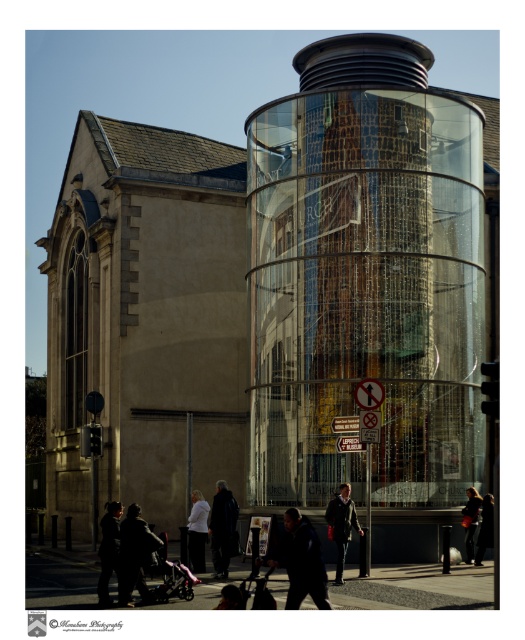
Is beige stone church at center bigger than dark blue coat at center?

Yes, beige stone church at center is bigger than dark blue coat at center.

Who is taller, beige stone church at center or dark blue coat at center?

With more height is beige stone church at center.

Does point (181, 157) lie behind point (227, 520)?

Yes.

This screenshot has height=640, width=525. I want to click on beige stone church at center, so click(x=281, y=298).

Does dark brown leather jacket at lower right have a smaller size compared to dark gray jacket at lower center?

Correct, dark brown leather jacket at lower right occupies less space than dark gray jacket at lower center.

Between dark brown leather jacket at lower right and dark gray jacket at lower center, which one has more height?

Standing taller between the two is dark brown leather jacket at lower right.

Identify the location of dark brown leather jacket at lower right. The height and width of the screenshot is (640, 525). (470, 520).

Does dark blue jacket at lower center have a larger size compared to dark blue coat at center?

Correct, dark blue jacket at lower center is larger in size than dark blue coat at center.

Find the location of a particular element. dark blue jacket at lower center is located at coordinates (x=300, y=561).